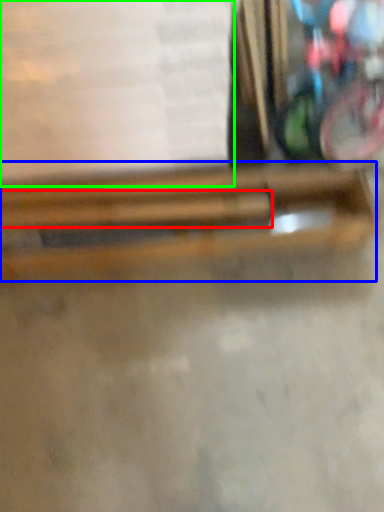
Question: Estimate the real-world distances between objects in this image. Which object is farther from wood (highlighted by a red box), wood (highlighted by a blue box) or paperback book (highlighted by a green box)?

Choices:
 (A) wood
 (B) paperback book

Answer: (B)